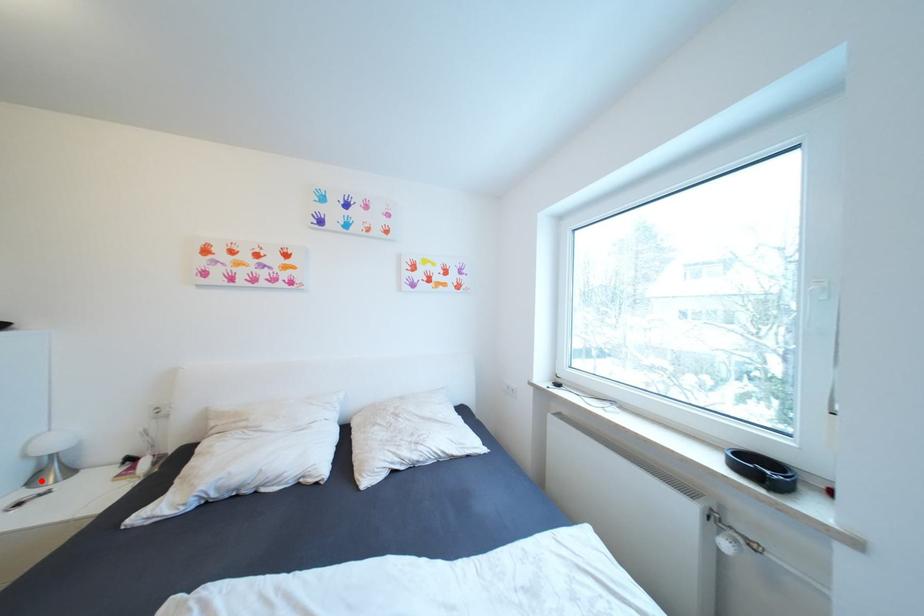
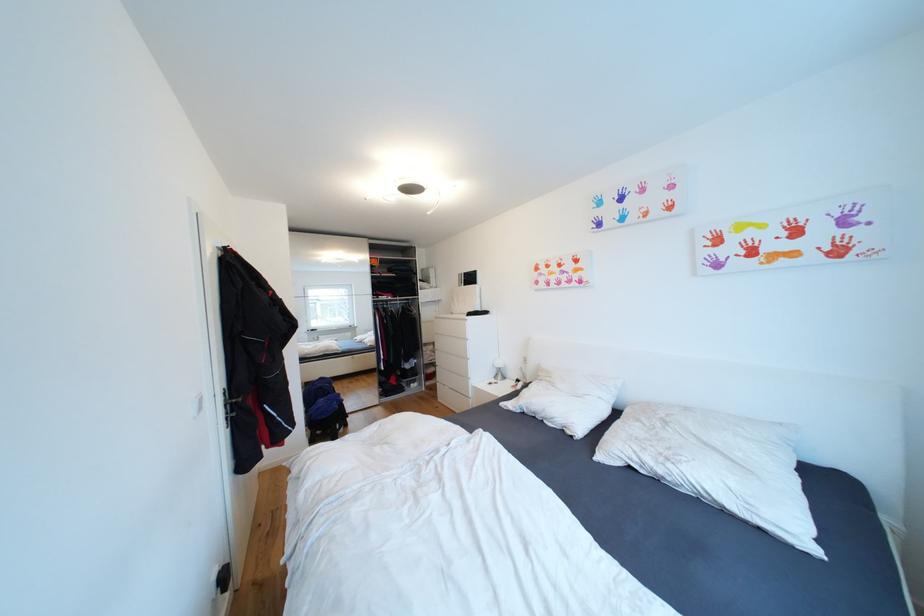
Question: I am providing you with two images of the same scene from different viewpoints. Given a red point in image1, look at the same physical point in image2. Is it:

Choices:
 (A) Closer to the viewpoint
 (B) Farther from the viewpoint

Answer: (B)